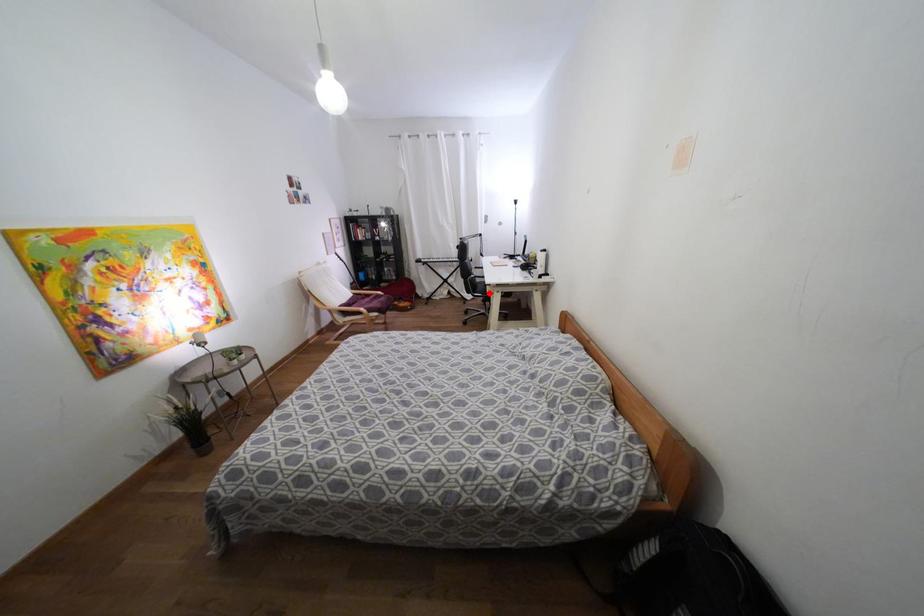
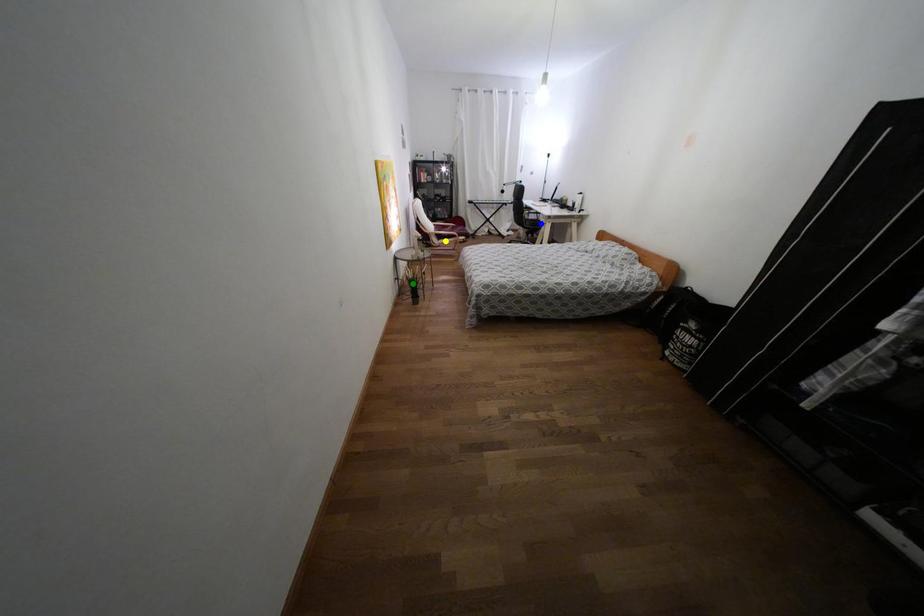
Question: I am providing you with two images of the same scene from different viewpoints. A red point is marked on the first image. You are given multiple points on the second image. Which point in image 2 represents the same 3d spot as the red point in image 1?

Choices:
 (A) green point
 (B) blue point
 (C) yellow point

Answer: (B)